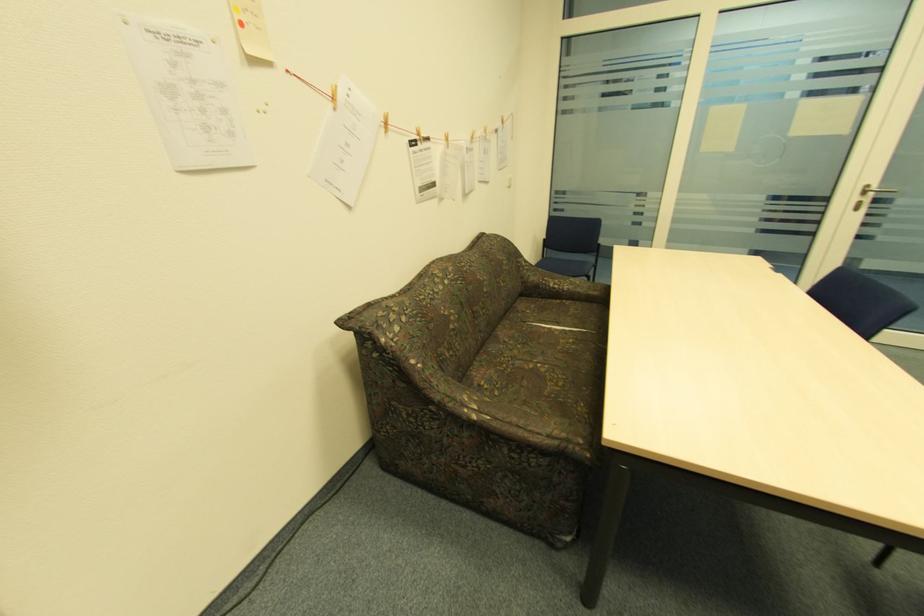
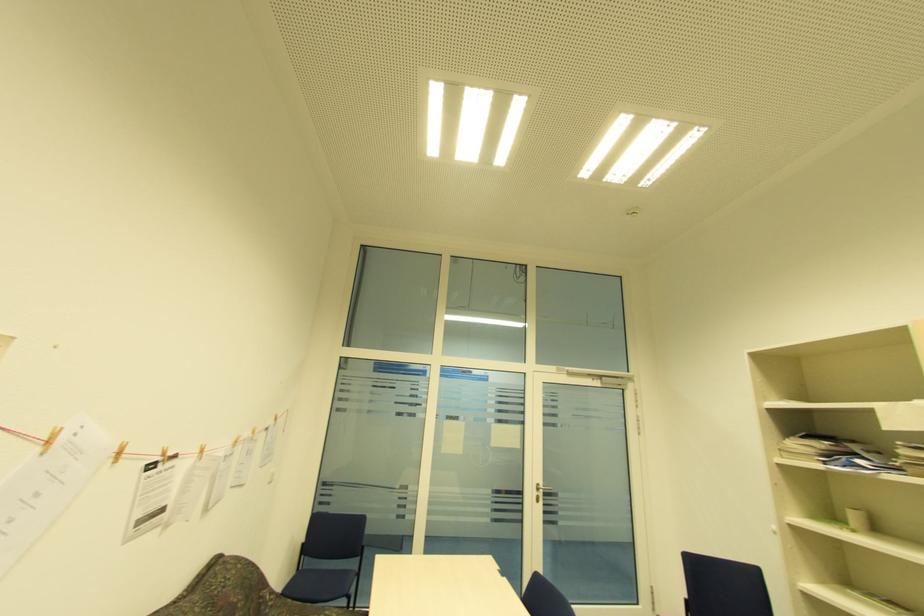
In the second image, find the point that corresponds to pixel 390 124 in the first image.

(120, 454)